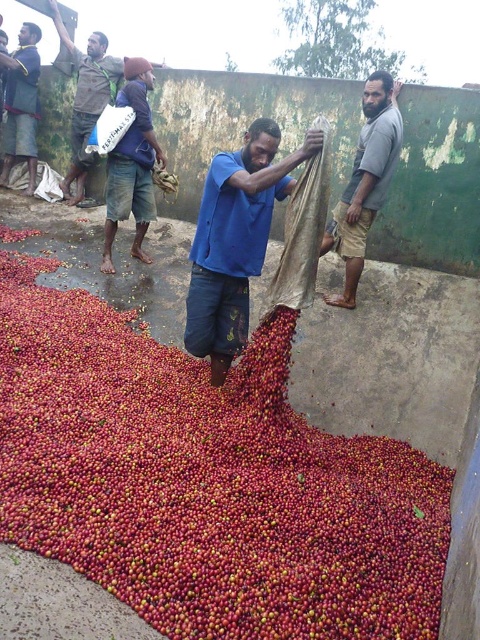
Question: Which object appears farthest from the camera in this image?

Choices:
 (A) blue denim shorts at center
 (B) blue cotton shirt at center
 (C) blue fabric bag at upper left
 (D) red matte coffee beans at center

Answer: (C)

Question: Which object appears farthest from the camera in this image?

Choices:
 (A) dark blue shirt at upper left
 (B) gray cotton shirt at center
 (C) blue fabric bag at upper left

Answer: (A)

Question: Which point is farther to the camera?

Choices:
 (A) dark blue shirt at upper left
 (B) blue cotton shirt at center
 (C) gray cotton shirt at center
 (D) red matte coffee beans at center

Answer: (A)

Question: Considering the relative positions of blue cotton shirt at center and dark blue shirt at upper left in the image provided, where is blue cotton shirt at center located with respect to dark blue shirt at upper left?

Choices:
 (A) right
 (B) left

Answer: (A)

Question: Can you confirm if red matte coffee beans at center is positioned to the right of blue fabric bag at upper left?

Choices:
 (A) no
 (B) yes

Answer: (B)

Question: Does gray cotton shirt at center appear on the right side of blue denim shorts at center?

Choices:
 (A) yes
 (B) no

Answer: (A)